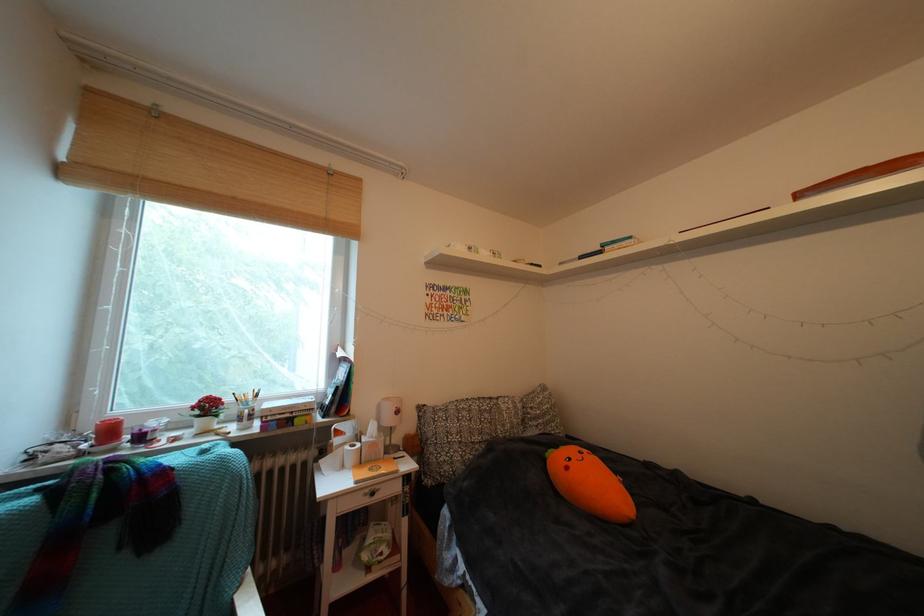
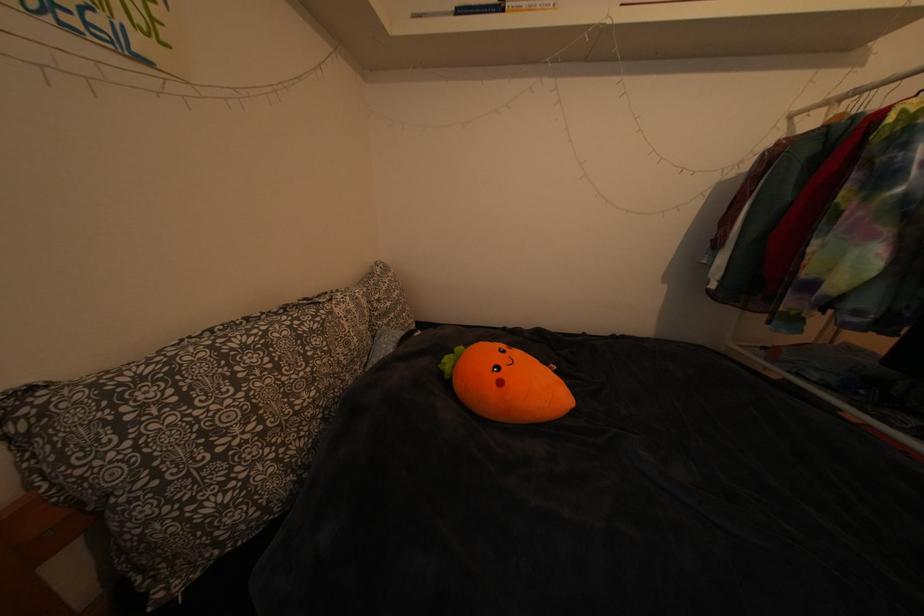
Where in the second image is the point corresponding to (518,413) from the first image?

(359, 317)